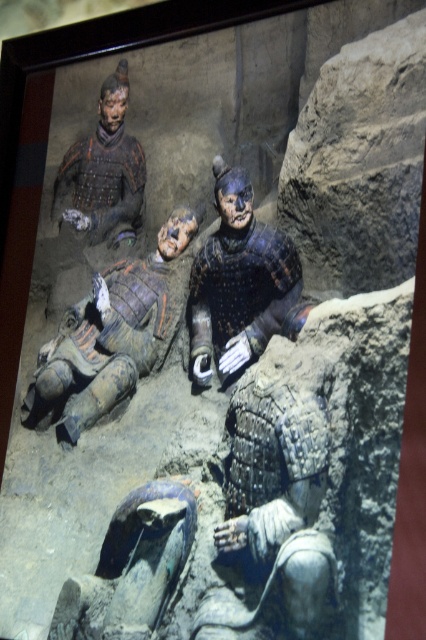
Question: Does matte painted figure at center appear on the right side of shiny black armor at center?

Choices:
 (A) yes
 (B) no

Answer: (B)

Question: Among these points, which one is farthest from the camera?

Choices:
 (A) click(216, 358)
 (B) click(74, 212)

Answer: (B)

Question: Can you confirm if matte painted figure at center is smaller than shiny metallic armor at upper left?

Choices:
 (A) yes
 (B) no

Answer: (B)

Question: Estimate the real-world distances between objects in this image. Which object is closer to the shiny black armor at center?

Choices:
 (A) matte painted figure at center
 (B) shiny metallic armor at upper left

Answer: (A)

Question: Which point is closer to the camera?

Choices:
 (A) shiny black armor at center
 (B) matte painted figure at center
 (C) shiny metallic armor at upper left

Answer: (A)

Question: Can you confirm if shiny black armor at center is positioned above shiny metallic armor at upper left?

Choices:
 (A) no
 (B) yes

Answer: (A)